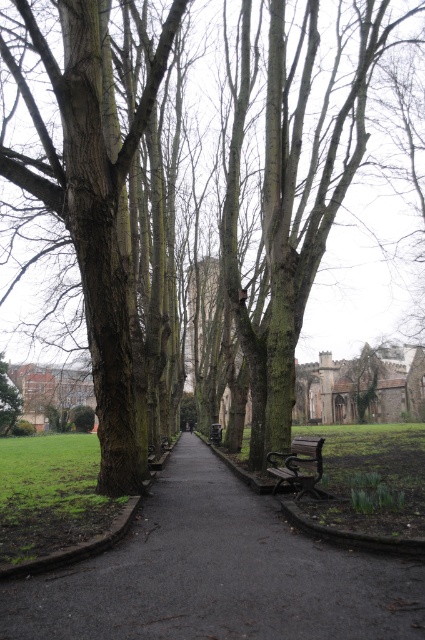
Is wooden bench at center to the right of green rough bark tree at left from the viewer's perspective?

Correct, you'll find wooden bench at center to the right of green rough bark tree at left.

Between point (274, 465) and point (11, 420), which one is positioned behind?

The point (11, 420) is more distant.

Is point (299, 436) positioned after point (6, 429)?

That is False.

The height and width of the screenshot is (640, 425). I want to click on wooden bench at center, so click(300, 465).

Is black asphalt path at center shorter than wooden bench at center?

Incorrect, black asphalt path at center's height does not fall short of wooden bench at center's.

Is black asphalt path at center smaller than wooden bench at center?

Actually, black asphalt path at center might be larger than wooden bench at center.

This screenshot has width=425, height=640. What are the coordinates of `black asphalt path at center` in the screenshot? It's located at (217, 573).

Identify the location of black asphalt path at center. Image resolution: width=425 pixels, height=640 pixels. (217, 573).

In the scene shown: Is dark brown bark tree at left in front of green rough bark tree at left?

Yes.

Who is positioned more to the right, dark brown bark tree at left or green rough bark tree at left?

Positioned to the right is dark brown bark tree at left.

Is point (124, 308) in front of point (14, 412)?

Yes, point (124, 308) is in front of point (14, 412).

At what (x,y) coordinates should I click in order to perform the action: click on dark brown bark tree at left. Please return your answer as a coordinate pair (x, y). Looking at the image, I should click on (93, 211).